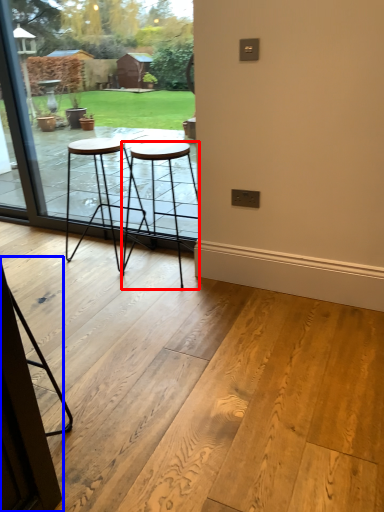
Question: Which object appears closest to the camera in this image, stool (highlighted by a red box) or screen door (highlighted by a blue box)?

Choices:
 (A) stool
 (B) screen door

Answer: (B)